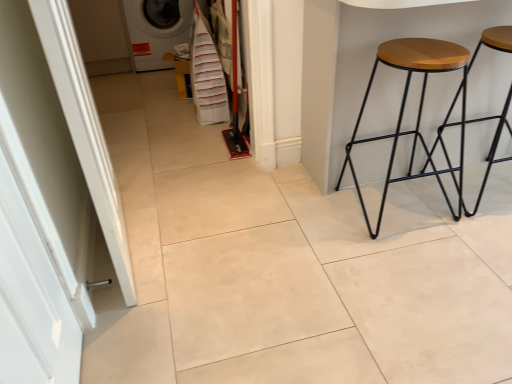
This screenshot has height=384, width=512. Identify the location of free spot in front of wooden/black metal stool at right, the 2th stool when ordered from right to left. (424, 261).